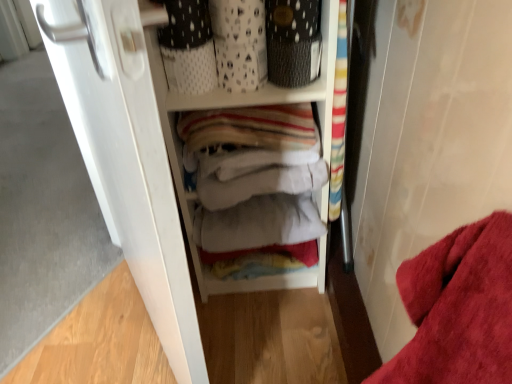
Question: Should I look upward or downward to see white matte door at left?

Choices:
 (A) down
 (B) up

Answer: (A)

Question: From the image's perspective, is white matte door at left below textured black basket at upper center?

Choices:
 (A) no
 (B) yes

Answer: (B)

Question: From the image's perspective, is white matte door at left located above textured black basket at upper center?

Choices:
 (A) yes
 (B) no

Answer: (B)

Question: Can you confirm if white matte door at left is shorter than textured black basket at upper center?

Choices:
 (A) yes
 (B) no

Answer: (B)

Question: Is white matte door at left thinner than textured black basket at upper center?

Choices:
 (A) yes
 (B) no

Answer: (B)

Question: Is white matte door at left turned away from textured black basket at upper center?

Choices:
 (A) yes
 (B) no

Answer: (A)

Question: Does white matte door at left turn towards textured black basket at upper center?

Choices:
 (A) yes
 (B) no

Answer: (A)

Question: From a real-world perspective, is textured black basket at upper center physically above white matte door at left?

Choices:
 (A) no
 (B) yes

Answer: (B)

Question: Does textured black basket at upper center have a greater height compared to white matte door at left?

Choices:
 (A) no
 (B) yes

Answer: (A)

Question: Would you consider textured black basket at upper center to be distant from white matte door at left?

Choices:
 (A) yes
 (B) no

Answer: (B)

Question: Considering the relative sizes of textured black basket at upper center and white matte door at left in the image provided, is textured black basket at upper center thinner than white matte door at left?

Choices:
 (A) no
 (B) yes

Answer: (B)

Question: Considering the relative sizes of textured black basket at upper center and white matte door at left in the image provided, is textured black basket at upper center shorter than white matte door at left?

Choices:
 (A) yes
 (B) no

Answer: (A)

Question: Does textured black basket at upper center come in front of white matte door at left?

Choices:
 (A) yes
 (B) no

Answer: (B)

Question: Considering the relative positions of white fabric at center and white matte door at left in the image provided, is white fabric at center to the right of white matte door at left from the viewer's perspective?

Choices:
 (A) no
 (B) yes

Answer: (B)